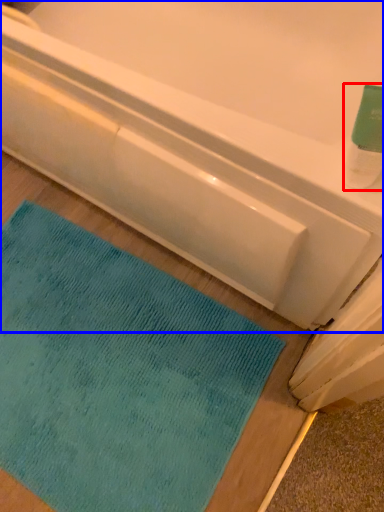
Question: Which of the following is the closest to the observer, cleaning product (highlighted by a red box) or bathtub (highlighted by a blue box)?

Choices:
 (A) cleaning product
 (B) bathtub

Answer: (A)